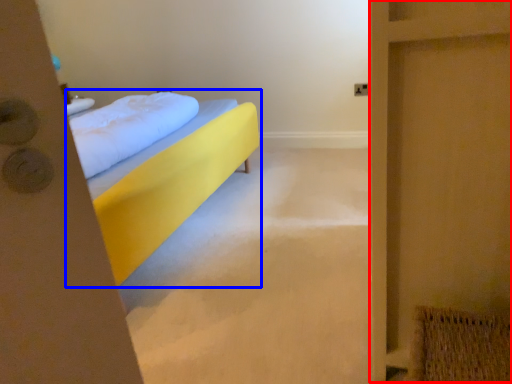
Question: Which object is closer to the camera taking this photo, screen door (highlighted by a red box) or bed (highlighted by a blue box)?

Choices:
 (A) screen door
 (B) bed

Answer: (A)